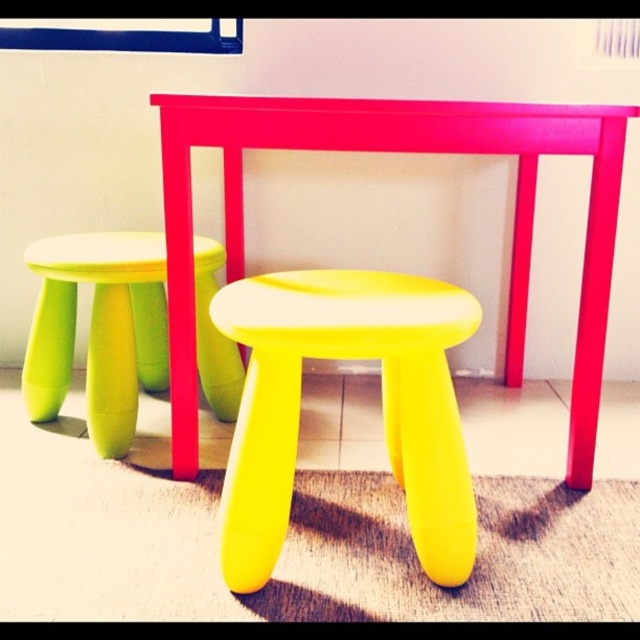
Question: Which point is farther to the camera?

Choices:
 (A) [182, 99]
 (B) [141, 312]

Answer: (B)

Question: Which of the following is the farthest from the observer?

Choices:
 (A) (115, 396)
 (B) (296, 275)

Answer: (A)

Question: Does yellow matte stool at center appear on the left side of matte pink table at center?

Choices:
 (A) yes
 (B) no

Answer: (A)

Question: Which point is farther to the camera?

Choices:
 (A) (109, 404)
 (B) (164, 166)

Answer: (A)

Question: In this image, where is matte pink table at center located relative to yellow matte stool at lower left?

Choices:
 (A) right
 (B) left

Answer: (A)

Question: Can you confirm if yellow matte stool at center is bigger than yellow matte stool at lower left?

Choices:
 (A) yes
 (B) no

Answer: (B)